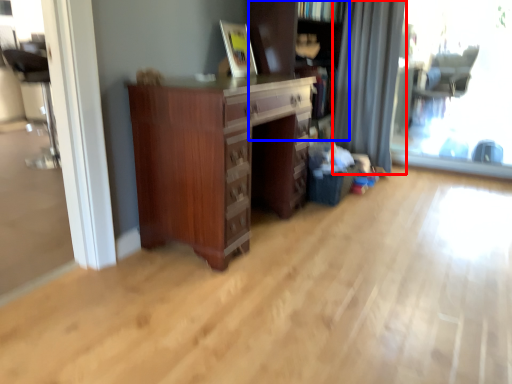
Question: Which point is further to the camera, curtain (highlighted by a red box) or bookcase (highlighted by a blue box)?

Choices:
 (A) curtain
 (B) bookcase

Answer: (A)